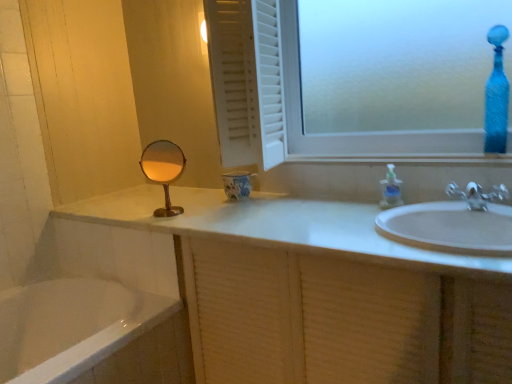
Question: Is gold metallic mirror at center in front of or behind blue textured glass vase at upper right in the image?

Choices:
 (A) behind
 (B) front

Answer: (A)

Question: In terms of size, does gold metallic mirror at center appear bigger or smaller than blue textured glass vase at upper right?

Choices:
 (A) small
 (B) big

Answer: (A)

Question: Based on their relative distances, which object is nearer to the blue textured glass vase at upper right?

Choices:
 (A) silver metallic faucet at right
 (B) white textured cabinet at lower right
 (C) gold metallic mirror at center
 (D) white glossy bathtub at lower left
 (E) white glossy sink at lower right

Answer: (A)

Question: Which object is the farthest from the white textured cabinet at lower right?

Choices:
 (A) translucent plastic soap dispenser at upper right
 (B) white glossy bathtub at lower left
 (C) silver metallic faucet at right
 (D) white glossy sink at lower right
 (E) gold metallic mirror at center

Answer: (C)